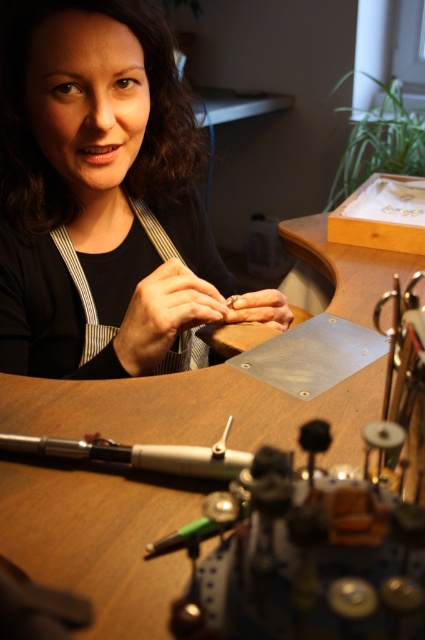
Consider the image. You are a new apprentice at the workshop and need to retrieve the matte silver tool at center to continue your work. However, the matte black apron at center is blocking your access. Based on the scene description, can you reach the tool without moving the apron?

The matte black apron at center is above the matte silver tool at center, so you can reach the tool without moving the apron since it is positioned below the apron.

You are a visitor observing the scene from the side of the room. You notice the matte black apron at center and the wooden table at center. Which object is higher in height?

The matte black apron at center is taller than the wooden table at center.